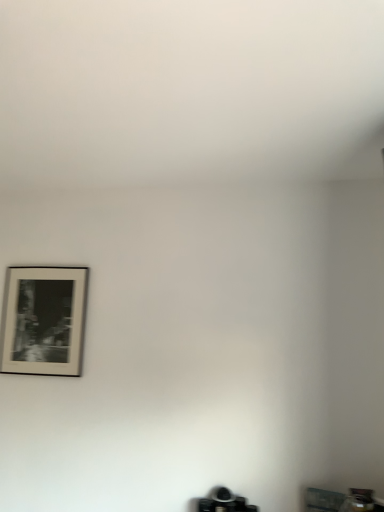
What is the approximate width of black matte picture frame at upper left?

black matte picture frame at upper left is 1.38 inches in width.

Locate an element on the screen. The image size is (384, 512). black matte picture frame at upper left is located at coordinates (43, 320).

What do you see at coordinates (43, 320) in the screenshot? I see `black matte picture frame at upper left` at bounding box center [43, 320].

In order to face black matte picture frame at upper left, should I rotate leftwards or rightwards?

To face it directly, rotate left by 19.177 degrees.

Locate an element on the screen. black matte picture frame at upper left is located at coordinates (43, 320).